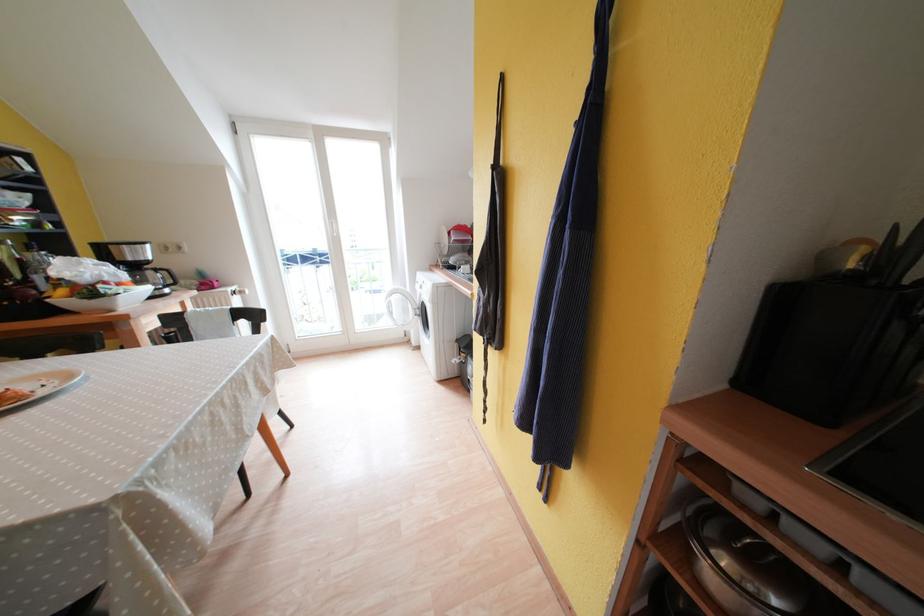
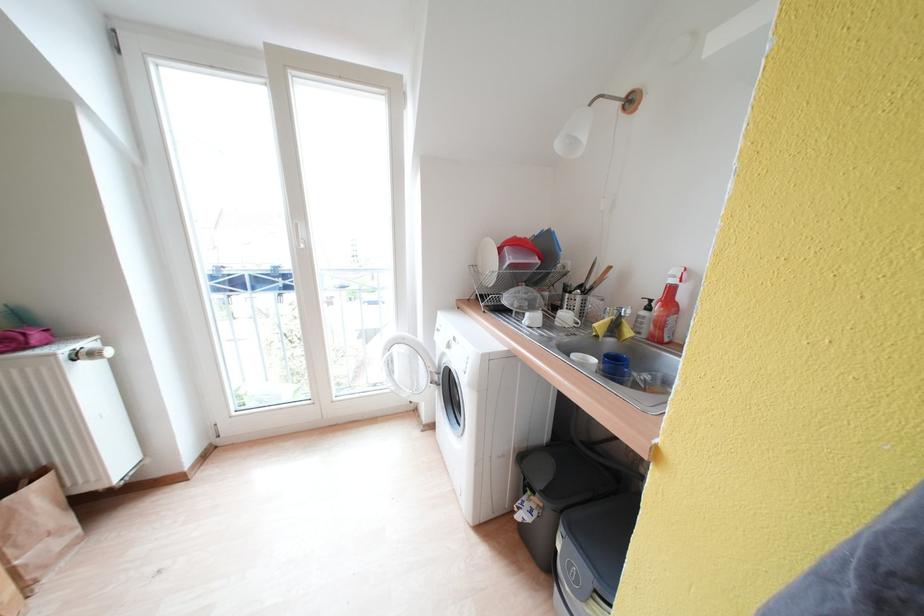
Where in the second image is the point corresponding to pixel 456 236 from the first image?

(505, 254)